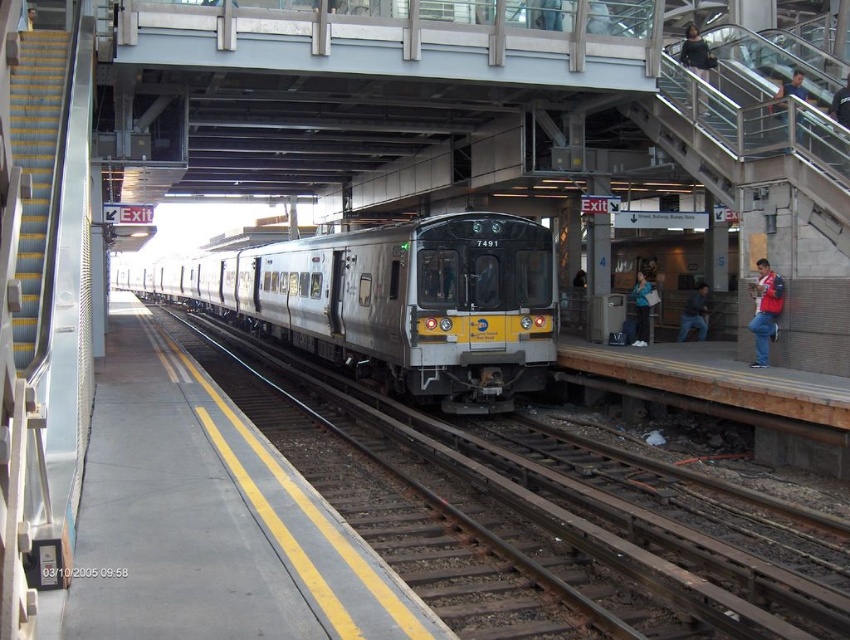
You are a passenger waiting at the train station and see two jackets near the platform edge. The jackets are the dark gray jacket at upper right and the denim jacket at lower right. Which jacket is positioned more to the right side of the platform?

The dark gray jacket at upper right is positioned more to the right side of the platform compared to the denim jacket at lower right.

From the picture: You are standing on the platform at the train station and want to walk from point (426, 385) to point (609, 509). Which direction should you move in to get closer to your destination?

To move from point (426, 385) to point (609, 509), you should move towards the upper right direction since point (609, 509) is located at a higher vertical position and further to the right compared to point (426, 385).